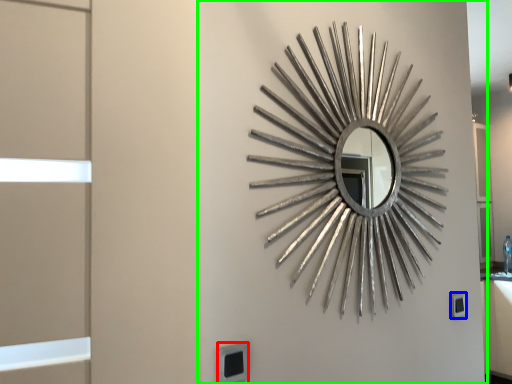
Question: Estimate the real-world distances between objects in this image. Which object is closer to electric outlet (highlighted by a red box), electric outlet (highlighted by a blue box) or backdrop (highlighted by a green box)?

Choices:
 (A) electric outlet
 (B) backdrop

Answer: (B)